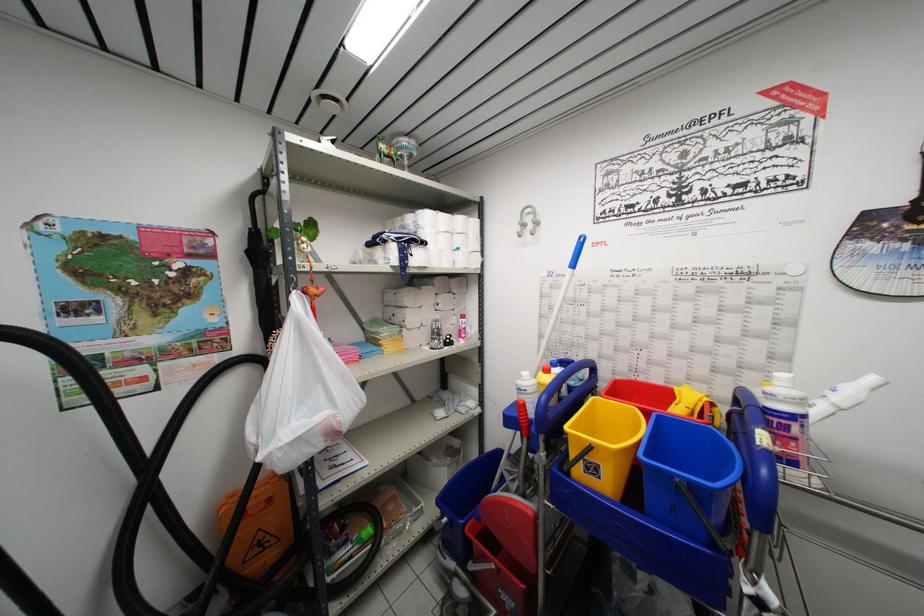
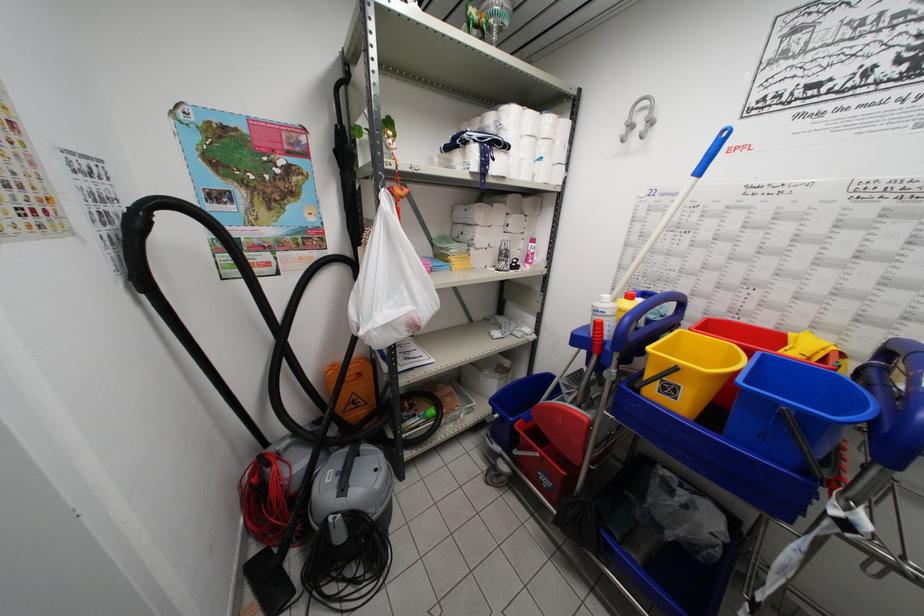
Question: Which direction would the cameraman need to move to produce the second image? Reply with the corresponding letter.

Choices:
 (A) Left
 (B) Right
 (C) Forward
 (D) Backward

Answer: (A)